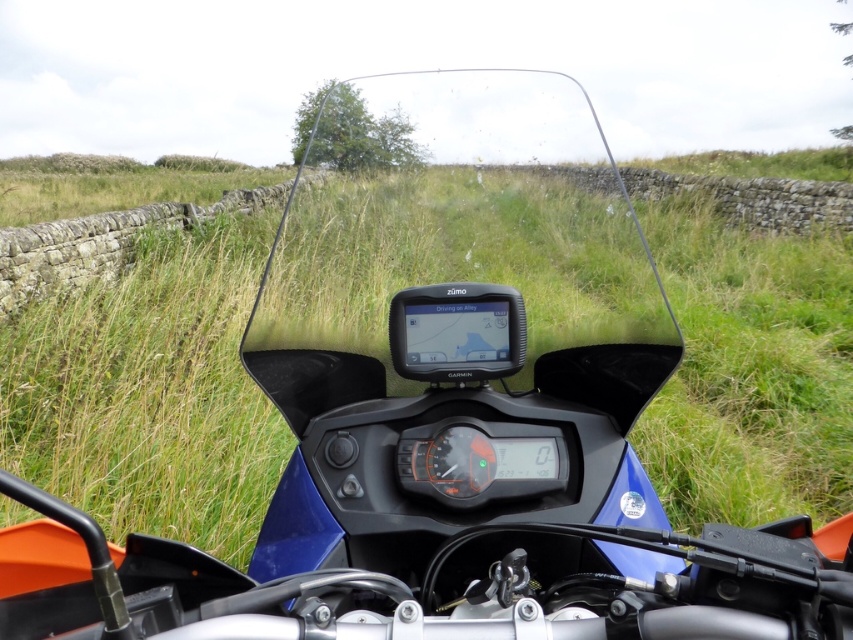
Does green grassy at center appear over transparent plastic windshield at center?

Indeed, green grassy at center is positioned over transparent plastic windshield at center.

Who is lower down, green grassy at center or transparent plastic windshield at center?

Positioned lower is transparent plastic windshield at center.

Does point (775, 300) come closer to viewer compared to point (598, 273)?

No, it is behind (598, 273).

Locate an element on the screen. Image resolution: width=853 pixels, height=640 pixels. green grassy at center is located at coordinates (149, 392).

Who is more distant from viewer, (606,161) or (425,358)?

The point (606,161) is more distant.

Can you confirm if transparent plastic windshield at center is positioned to the left of matte black gps at center?

Incorrect, transparent plastic windshield at center is not on the left side of matte black gps at center.

Is point (444, 352) less distant than point (395, 310)?

Yes, it is in front of point (395, 310).

Find the location of a particular element. The height and width of the screenshot is (640, 853). transparent plastic windshield at center is located at coordinates (459, 253).

Is point (212, 369) less distant than point (469, 332)?

No, it is behind (469, 332).

Between green grassy at center and matte black gps at center, which one is positioned lower?

matte black gps at center is lower down.

Is point (724, 266) less distant than point (474, 301)?

No, (724, 266) is further to viewer.

You are a GUI agent. You are given a task and a screenshot of the screen. Output one action in this format:
    pyautogui.click(x=<x>, y=<y>)
    Task: Click on the green grassy at center
    Image resolution: width=853 pixels, height=640 pixels.
    Given the screenshot: What is the action you would take?
    pyautogui.click(x=149, y=392)